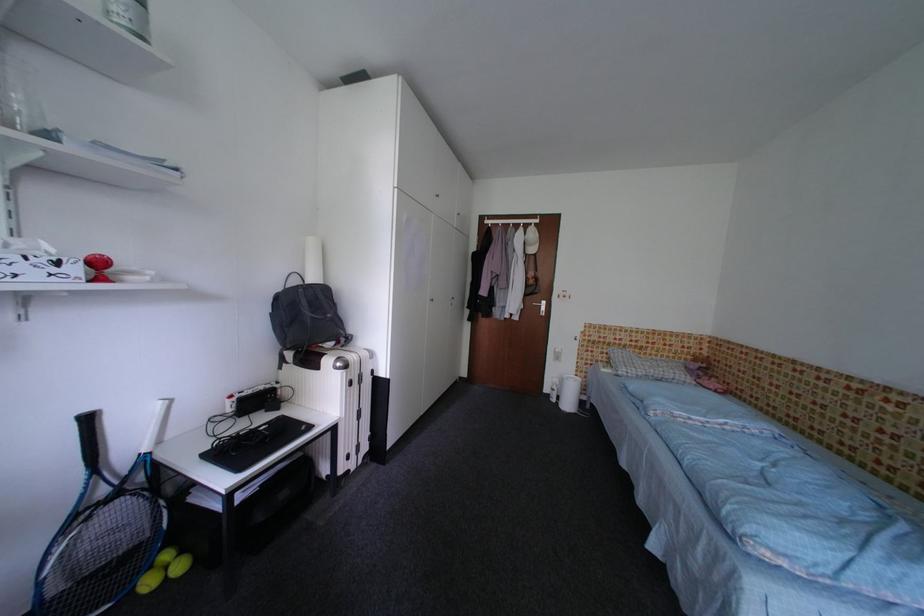
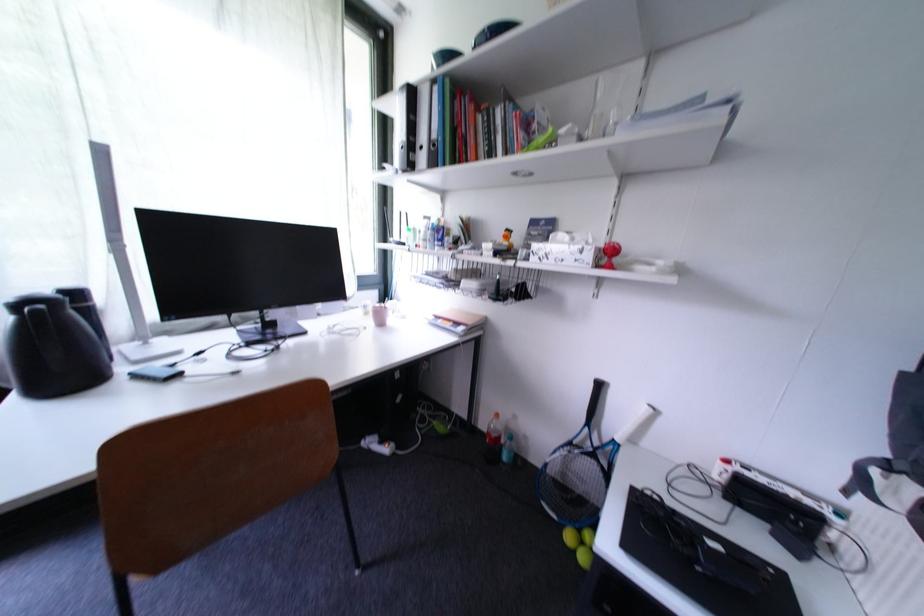
In the second image, find the point that corresponds to [156,586] in the first image.

(578, 540)